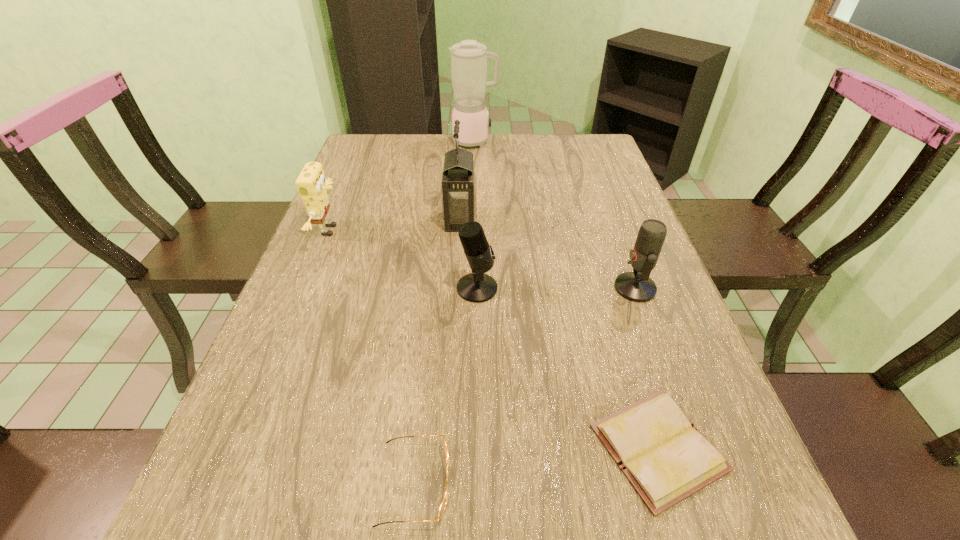
Find the location of a particular element. This screenshot has height=540, width=960. free space located on the face of the leftmost object is located at coordinates (450, 231).

Where is `vacant space situated 0.380m on the stand of the left microphone`? vacant space situated 0.380m on the stand of the left microphone is located at coordinates (665, 288).

The image size is (960, 540). Find the location of `free region located on the side of the right microphone with the red ring`. free region located on the side of the right microphone with the red ring is located at coordinates (x=553, y=288).

Locate an element on the screen. vacant space positioned 0.160m on the side of the right microphone with the red ring is located at coordinates pyautogui.click(x=544, y=288).

Where is `vacant space located 0.140m on the side of the right microphone with the red ring`? This screenshot has width=960, height=540. vacant space located 0.140m on the side of the right microphone with the red ring is located at coordinates pyautogui.click(x=553, y=288).

Locate an element on the screen. Image resolution: width=960 pixels, height=540 pixels. vacant space situated 0.100m on the front-facing side of the sixth tallest object is located at coordinates (515, 483).

Where is `vacant space located 0.080m on the back of the shortest object`? The width and height of the screenshot is (960, 540). vacant space located 0.080m on the back of the shortest object is located at coordinates (630, 356).

Where is `object that is at the far edge`? This screenshot has width=960, height=540. object that is at the far edge is located at coordinates (468, 59).

Where is `object that is at the near edge`? Image resolution: width=960 pixels, height=540 pixels. object that is at the near edge is located at coordinates (443, 504).

I want to click on object at the left edge, so click(x=312, y=186).